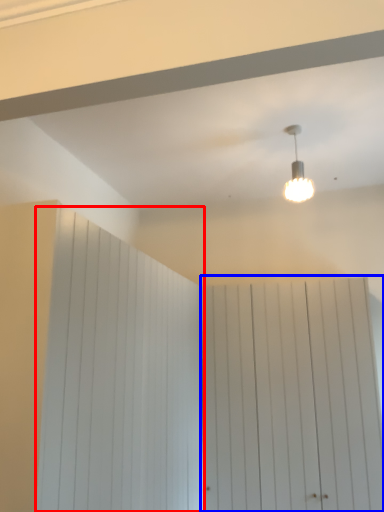
Question: Which point is closer to the camera, barn door (highlighted by a red box) or barn door (highlighted by a blue box)?

Choices:
 (A) barn door
 (B) barn door

Answer: (A)